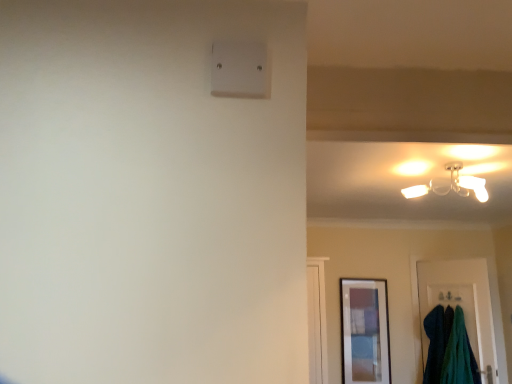
Question: Can you confirm if teal fabric door at lower right is taller than matte white ceiling light at upper right?

Choices:
 (A) no
 (B) yes

Answer: (B)

Question: Is teal fabric door at lower right completely or partially outside of matte white ceiling light at upper right?

Choices:
 (A) yes
 (B) no

Answer: (A)

Question: Does teal fabric door at lower right have a smaller size compared to matte white ceiling light at upper right?

Choices:
 (A) yes
 (B) no

Answer: (B)

Question: From a real-world perspective, is teal fabric door at lower right beneath matte white ceiling light at upper right?

Choices:
 (A) no
 (B) yes

Answer: (B)

Question: From the image's perspective, is teal fabric door at lower right located beneath matte white ceiling light at upper right?

Choices:
 (A) no
 (B) yes

Answer: (B)

Question: From the image's perspective, is velvety teal towels at lower right positioned above or below matte white ceiling light at upper right?

Choices:
 (A) below
 (B) above

Answer: (A)

Question: In the image, is velvety teal towels at lower right positioned in front of or behind matte white ceiling light at upper right?

Choices:
 (A) behind
 (B) front

Answer: (A)

Question: In the image, is velvety teal towels at lower right on the left side or the right side of matte white ceiling light at upper right?

Choices:
 (A) left
 (B) right

Answer: (B)

Question: Is velvety teal towels at lower right inside or outside of matte white ceiling light at upper right?

Choices:
 (A) outside
 (B) inside

Answer: (A)

Question: Does point (478, 185) appear closer or farther from the camera than point (466, 329)?

Choices:
 (A) farther
 (B) closer

Answer: (B)

Question: Is matte white ceiling light at upper right spatially inside teal fabric door at lower right, or outside of it?

Choices:
 (A) inside
 (B) outside

Answer: (B)

Question: From a real-world perspective, is matte white ceiling light at upper right above or below teal fabric door at lower right?

Choices:
 (A) above
 (B) below

Answer: (A)

Question: Is matte white ceiling light at upper right to the left or to the right of teal fabric door at lower right in the image?

Choices:
 (A) left
 (B) right

Answer: (A)

Question: Do you think white plastic light switch at upper center is within velvety teal towels at lower right, or outside of it?

Choices:
 (A) outside
 (B) inside

Answer: (A)

Question: Considering the positions of white plastic light switch at upper center and velvety teal towels at lower right in the image, is white plastic light switch at upper center taller or shorter than velvety teal towels at lower right?

Choices:
 (A) short
 (B) tall

Answer: (A)